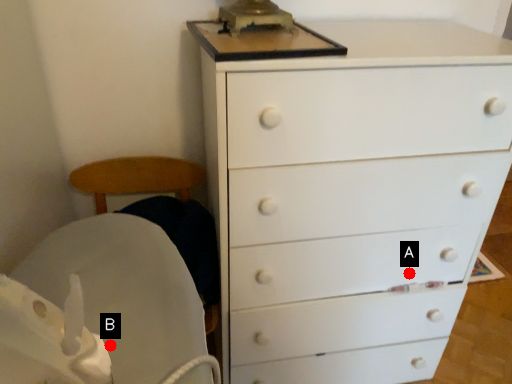
Question: Two points are circled on the image, labeled by A and B beside each circle. Which of the following is the closest to the observer?

Choices:
 (A) A is closer
 (B) B is closer

Answer: (B)